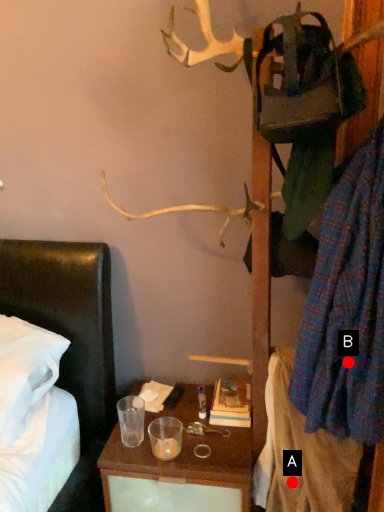
Question: Two points are circled on the image, labeled by A and B beside each circle. Which point appears closest to the camera in this image?

Choices:
 (A) A is closer
 (B) B is closer

Answer: (B)